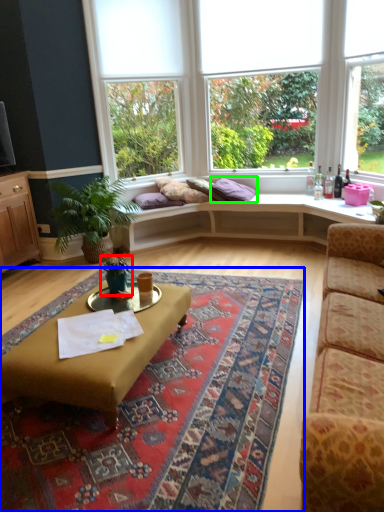
Question: Which is nearer to the houseplant (highlighted by a red box)? mat (highlighted by a blue box) or pillow (highlighted by a green box).

Choices:
 (A) mat
 (B) pillow

Answer: (A)